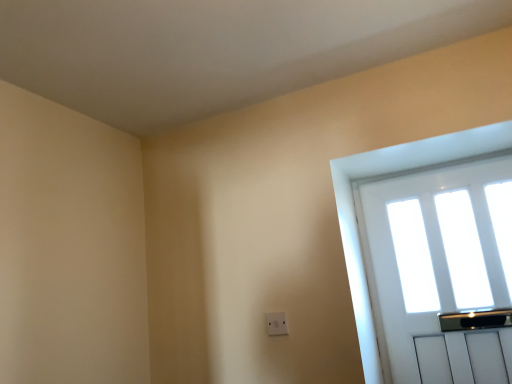
Question: Should I look upward or downward to see white plastic electric outlet at center?

Choices:
 (A) up
 (B) down

Answer: (B)

Question: Does white plastic electric outlet at center turn towards white wooden door at upper right?

Choices:
 (A) no
 (B) yes

Answer: (A)

Question: Would you say white plastic electric outlet at center contains white wooden door at upper right?

Choices:
 (A) yes
 (B) no

Answer: (B)

Question: Is white plastic electric outlet at center outside of white wooden door at upper right?

Choices:
 (A) yes
 (B) no

Answer: (A)

Question: Is white plastic electric outlet at center to the left of white wooden door at upper right from the viewer's perspective?

Choices:
 (A) no
 (B) yes

Answer: (B)

Question: Does white plastic electric outlet at center appear on the right side of white wooden door at upper right?

Choices:
 (A) yes
 (B) no

Answer: (B)

Question: Would you consider white plastic electric outlet at center to be distant from white wooden door at upper right?

Choices:
 (A) yes
 (B) no

Answer: (B)

Question: Can you confirm if white wooden door at upper right is positioned to the right of white plastic electric outlet at center?

Choices:
 (A) yes
 (B) no

Answer: (A)

Question: Is white plastic electric outlet at center at the back of white wooden door at upper right?

Choices:
 (A) yes
 (B) no

Answer: (B)

Question: Is white wooden door at upper right with white plastic electric outlet at center?

Choices:
 (A) no
 (B) yes

Answer: (A)

Question: Is white plastic electric outlet at center located within white wooden door at upper right?

Choices:
 (A) yes
 (B) no

Answer: (B)

Question: From the image's perspective, is white wooden door at upper right on top of white plastic electric outlet at center?

Choices:
 (A) yes
 (B) no

Answer: (A)

Question: Is white wooden door at upper right oriented towards white plastic electric outlet at center?

Choices:
 (A) yes
 (B) no

Answer: (B)

Question: Choose the correct answer: Is white plastic electric outlet at center inside white wooden door at upper right or outside it?

Choices:
 (A) outside
 (B) inside

Answer: (A)